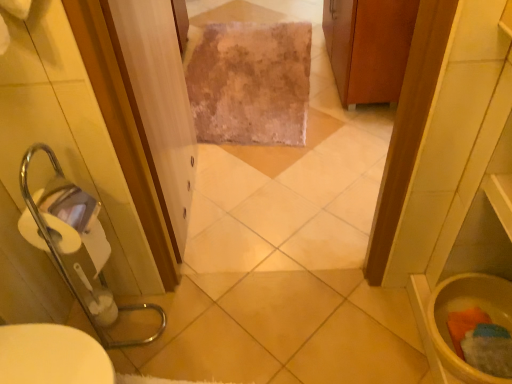
Question: Is fuzzy beige rug at center beside wooden cabinet at upper right?

Choices:
 (A) no
 (B) yes

Answer: (A)

Question: Considering the relative sizes of fuzzy beige rug at center and wooden cabinet at upper right in the image provided, is fuzzy beige rug at center smaller than wooden cabinet at upper right?

Choices:
 (A) yes
 (B) no

Answer: (A)

Question: From a real-world perspective, does fuzzy beige rug at center sit lower than wooden cabinet at upper right?

Choices:
 (A) no
 (B) yes

Answer: (B)

Question: Can you confirm if fuzzy beige rug at center is positioned to the right of wooden cabinet at upper right?

Choices:
 (A) yes
 (B) no

Answer: (B)

Question: Is fuzzy beige rug at center facing away from wooden cabinet at upper right?

Choices:
 (A) yes
 (B) no

Answer: (B)

Question: Is fuzzy beige rug at center taller than wooden cabinet at upper right?

Choices:
 (A) yes
 (B) no

Answer: (B)

Question: Does wooden cabinet at upper right appear on the left side of fuzzy beige rug at center?

Choices:
 (A) no
 (B) yes

Answer: (A)

Question: From a real-world perspective, is wooden cabinet at upper right over fuzzy beige rug at center?

Choices:
 (A) no
 (B) yes

Answer: (B)

Question: From the image's perspective, is wooden cabinet at upper right below fuzzy beige rug at center?

Choices:
 (A) no
 (B) yes

Answer: (A)

Question: Is wooden cabinet at upper right looking in the opposite direction of fuzzy beige rug at center?

Choices:
 (A) yes
 (B) no

Answer: (B)

Question: Is the position of wooden cabinet at upper right more distant than that of fuzzy beige rug at center?

Choices:
 (A) no
 (B) yes

Answer: (A)

Question: Is wooden cabinet at upper right located outside fuzzy beige rug at center?

Choices:
 (A) yes
 (B) no

Answer: (A)

Question: Considering the relative positions of clear plastic screen door at center and yellow matte toilet bowl at lower right in the image provided, is clear plastic screen door at center to the right of yellow matte toilet bowl at lower right from the viewer's perspective?

Choices:
 (A) yes
 (B) no

Answer: (B)